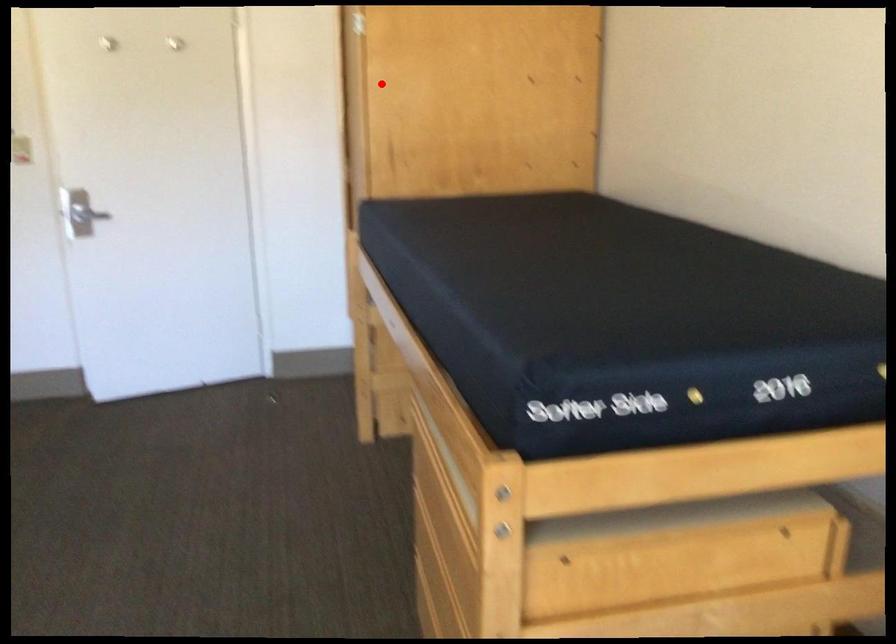
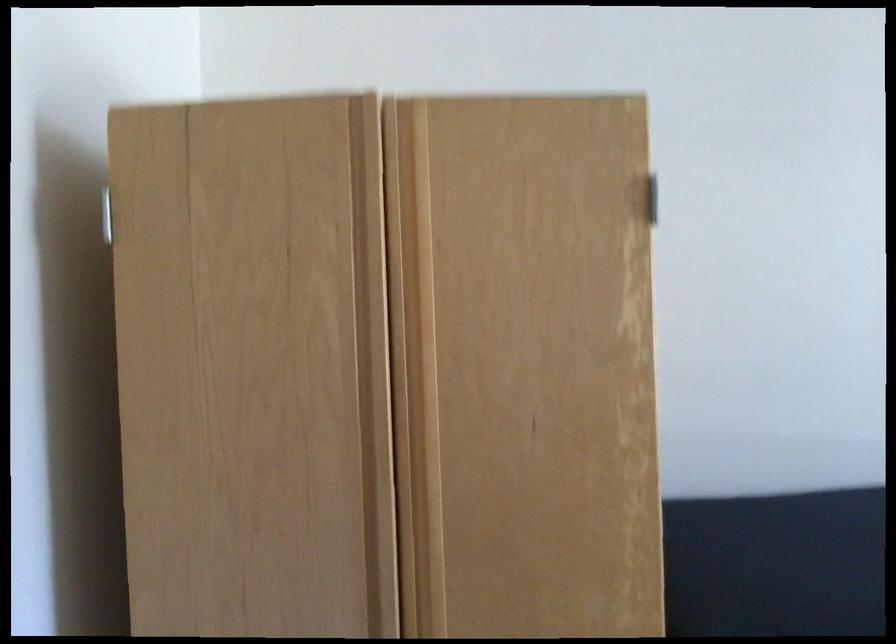
Question: I am providing you with two images of the same scene from different viewpoints. Image1 has a red point marked. In image2, the corresponding 3D location appears at what relative position? Reply with the corresponding letter.

Choices:
 (A) Closer
 (B) Farther

Answer: (A)